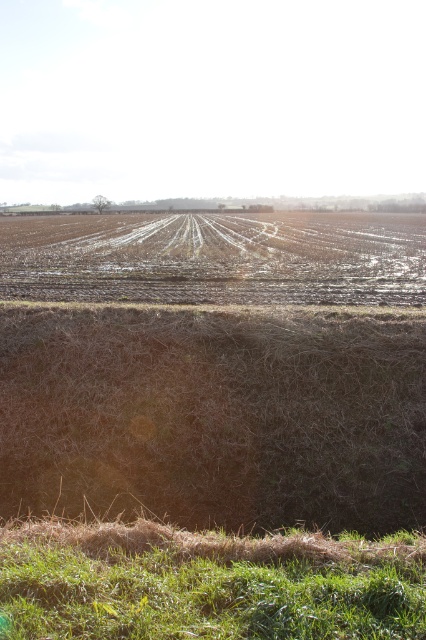
Can you confirm if brown dry hay at lower center is positioned above green grassy hill at lower center?

Yes, brown dry hay at lower center is above green grassy hill at lower center.

Is point (408, 445) farther from camera compared to point (146, 636)?

Yes, point (408, 445) is farther from viewer.

Does point (123, 474) come closer to viewer compared to point (249, 557)?

That is False.

This screenshot has width=426, height=640. In order to click on brown dry hay at lower center in this screenshot , I will do `click(215, 413)`.